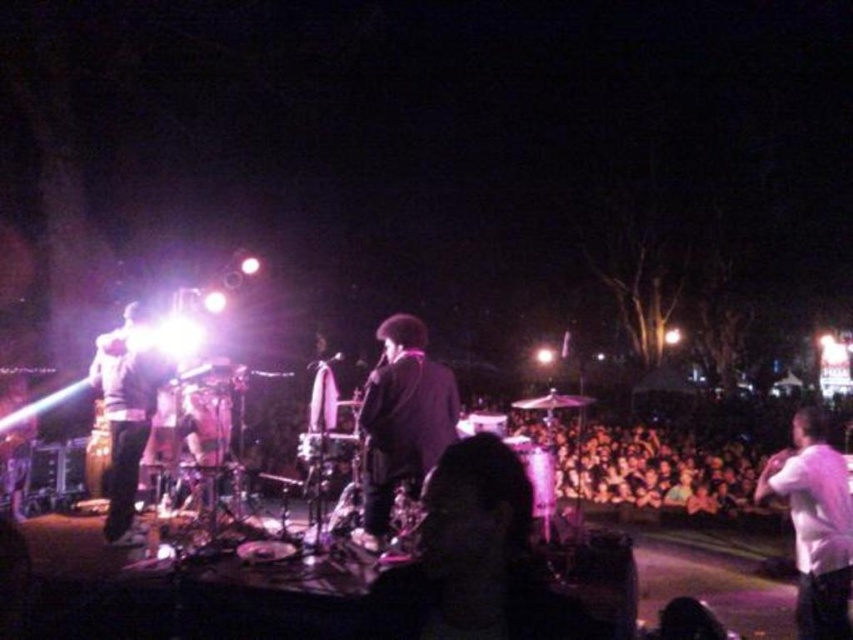
Question: Which object is closer to the camera taking this photo?

Choices:
 (A) shiny silver guitar at left
 (B) shiny black saxophone at center

Answer: (B)

Question: Is shiny black saxophone at center in front of shiny silver guitar at left?

Choices:
 (A) no
 (B) yes

Answer: (B)

Question: Which of these objects is positioned farthest from the white matte shirt at right?

Choices:
 (A) shiny silver guitar at left
 (B) dark hair at center
 (C) shiny black saxophone at center

Answer: (A)

Question: Is shiny black saxophone at center closer to the viewer compared to white matte shirt at right?

Choices:
 (A) yes
 (B) no

Answer: (B)

Question: Which object appears closest to the camera in this image?

Choices:
 (A) white matte shirt at right
 (B) dark hair at center

Answer: (B)

Question: Observing the image, what is the correct spatial positioning of dark hair at center in reference to shiny silver guitar at left?

Choices:
 (A) below
 (B) above

Answer: (A)